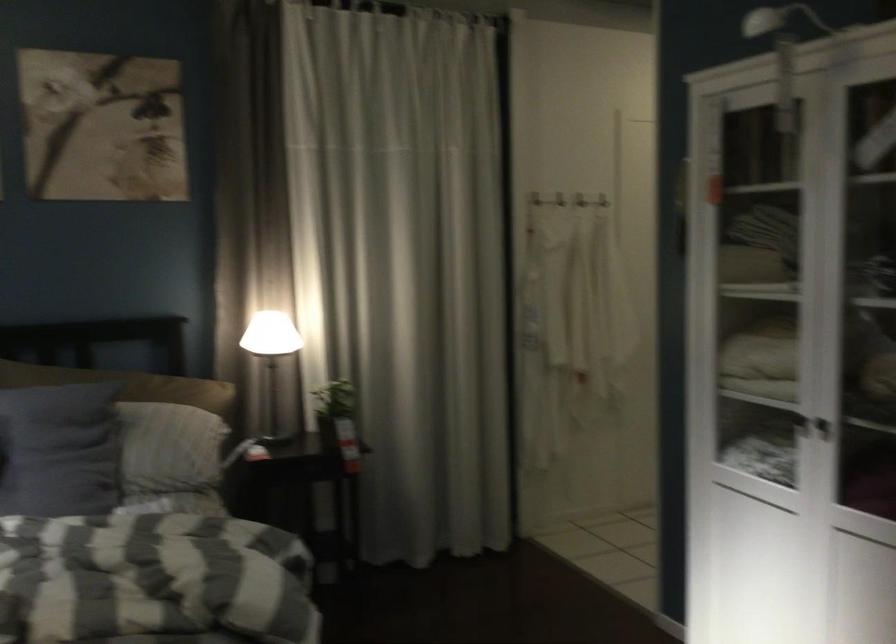
The image size is (896, 644). I want to click on white wall hook, so click(x=567, y=200).